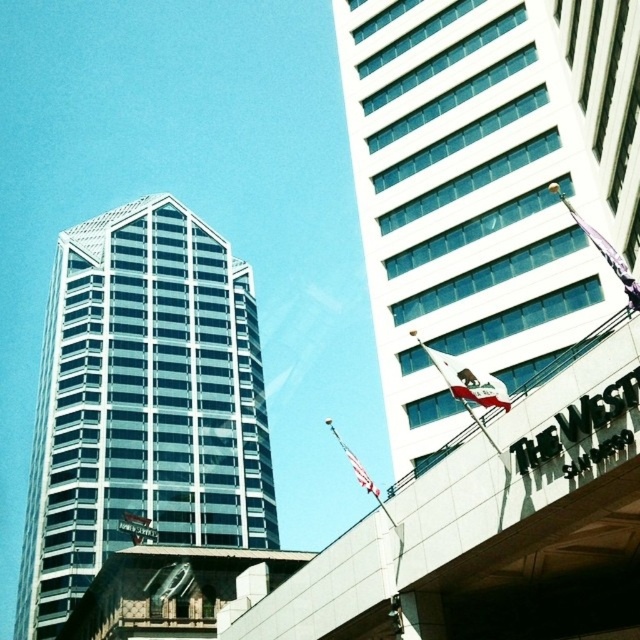
You are a drone operator trying to take a photo of the cityscape. Your camera is currently focused on the modern glass skyscraper on the left. To include the white glass building at upper right in your shot, should you pan your camera to the left or to the right?

Since the white glass building at upper right is located at point 0.287 on the x axis, which is to the left of the center point of the image, you should pan your camera to the left to include it in the shot.